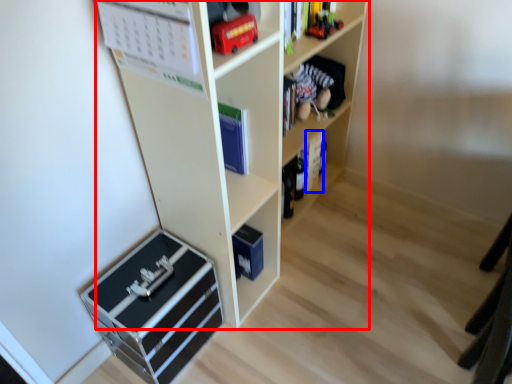
Question: Among these objects, which one is farthest to the camera, shelf (highlighted by a red box) or book (highlighted by a blue box)?

Choices:
 (A) shelf
 (B) book

Answer: (B)